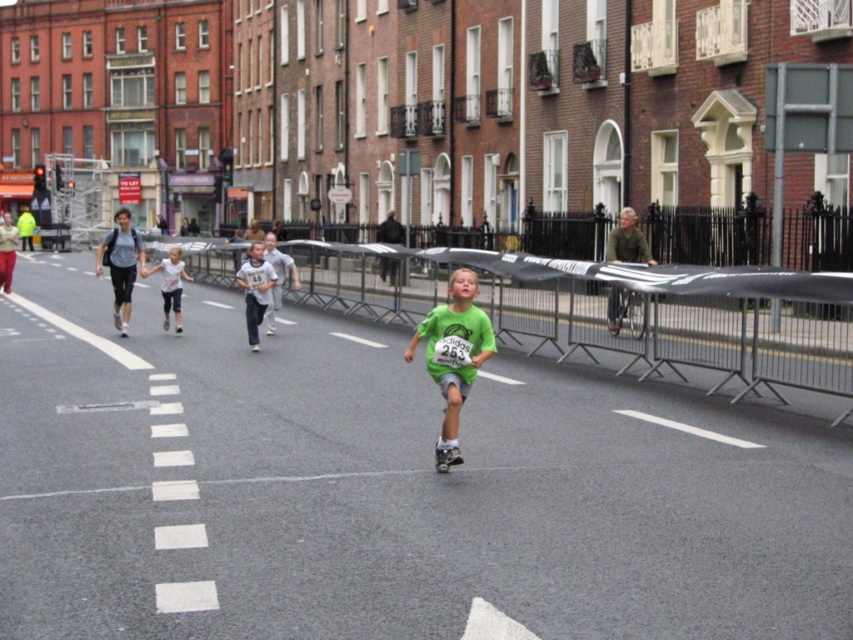
Question: Which point is closer to the camera taking this photo?

Choices:
 (A) (254, 280)
 (B) (163, 288)

Answer: (A)

Question: Which point is closer to the camera?

Choices:
 (A) light blue denim shorts at center
 (B) green textured shirt at center

Answer: (B)

Question: Is light gray cotton shirt at center below light blue denim shorts at center?

Choices:
 (A) no
 (B) yes

Answer: (B)

Question: Is the position of green matte shirt at center less distant than that of light gray cotton shirt at center?

Choices:
 (A) yes
 (B) no

Answer: (A)

Question: Can you confirm if green textured shirt at center is wider than light blue denim shorts at center?

Choices:
 (A) yes
 (B) no

Answer: (B)

Question: Which is farther from the green textured shirt at center?

Choices:
 (A) light blue denim shorts at center
 (B) light gray cotton shirt at center
 (C) green matte shirt at center

Answer: (C)